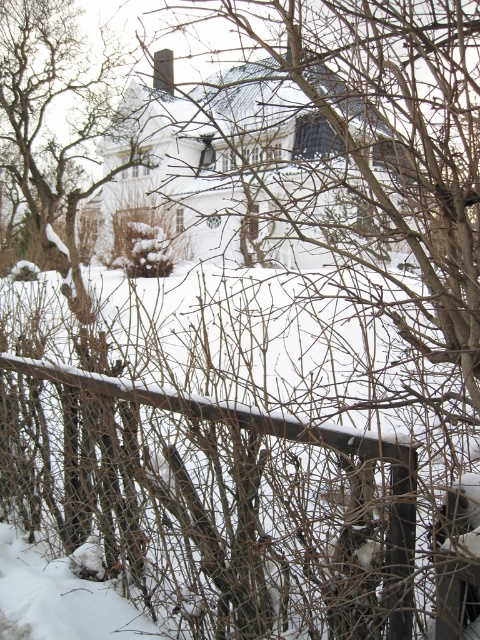
Looking at this image, you are a bird looking for a place to perch. You see the brown textured tree at upper left and the metal fence at center. Which one is higher up in the image?

The brown textured tree at upper left is located above the metal fence at center, so it is higher up in the image.

You are standing in the winter scene and want to walk towards the brown textured tree at upper left and the metal fence at center. Which object will you encounter first?

You will encounter the brown textured tree at upper left first because it is closer to you than the metal fence at center.